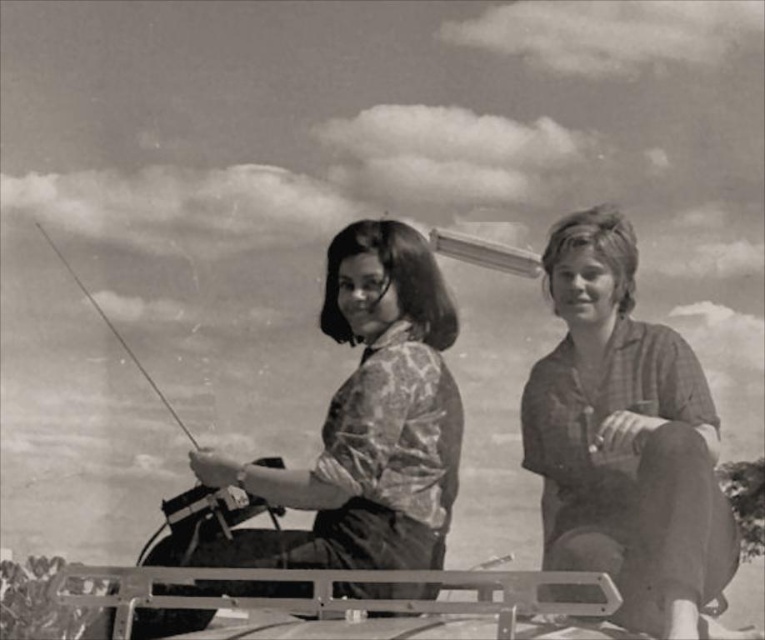
Does plaid shirt at right come in front of patterned fabric shirt at center?

Yes, plaid shirt at right is closer to the viewer.

Is plaid shirt at right bigger than patterned fabric shirt at center?

Indeed, plaid shirt at right has a larger size compared to patterned fabric shirt at center.

Between point (580, 227) and point (420, 490), which one is positioned behind?

The point (580, 227) is more distant.

This screenshot has width=765, height=640. I want to click on plaid shirt at right, so click(x=624, y=440).